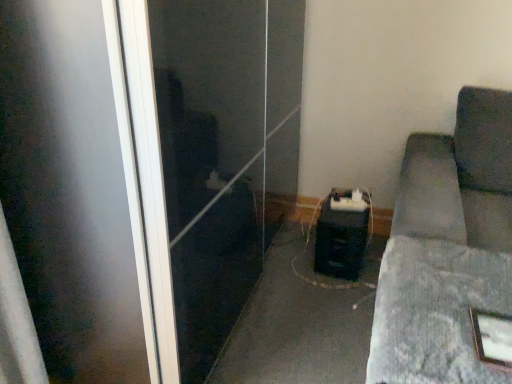
Find the location of a particular element. Image resolution: width=512 pixels, height=384 pixels. dark gray fabric couch at right is located at coordinates (447, 249).

The height and width of the screenshot is (384, 512). Find the location of `dark gray fabric couch at right`. dark gray fabric couch at right is located at coordinates (447, 249).

Is transparent glass screen door at center at the back of dark gray fabric couch at right?

No, dark gray fabric couch at right is not facing the opposite direction of transparent glass screen door at center.

Is dark gray fabric couch at right located outside transparent glass screen door at center?

Yes, dark gray fabric couch at right is not within transparent glass screen door at center.

Based on the photo, does dark gray fabric couch at right have a greater height compared to transparent glass screen door at center?

No.

Does dark gray fabric couch at right come behind transparent glass screen door at center?

No, dark gray fabric couch at right is in front of transparent glass screen door at center.

Consider the image. From a real-world perspective, is transparent glass screen door at center located higher than gray fabric couch at lower right, the 1th concrete positioned from the front?

Yes, from a real-world perspective, transparent glass screen door at center is on top of gray fabric couch at lower right, the 1th concrete positioned from the front.

Between transparent glass screen door at center and gray fabric couch at lower right, which is the second concrete from back to front, which one appears on the left side from the viewer's perspective?

From the viewer's perspective, transparent glass screen door at center appears more on the left side.

In the scene shown: From the image's perspective, which one is positioned higher, transparent glass screen door at center or gray fabric couch at lower right, which is the second concrete from back to front?

transparent glass screen door at center.

Image resolution: width=512 pixels, height=384 pixels. I want to click on furniture on the right of the black plastic speaker at center, the 2th concrete viewed from the front, so click(x=447, y=249).

Does point (284, 278) appear closer or farther from the camera than point (383, 295)?

Clearly, point (284, 278) is more distant from the camera than point (383, 295).

Is the depth of black plastic speaker at center, the 2th concrete viewed from the front, greater than that of dark gray fabric couch at right?

Yes, it is behind dark gray fabric couch at right.

From a real-world perspective, is black plastic speaker at center, the 2th concrete viewed from the front, physically located above or below dark gray fabric couch at right?

From a real-world perspective, black plastic speaker at center, the 2th concrete viewed from the front, is physically below dark gray fabric couch at right.

Does gray fabric couch at lower right, the 1th concrete positioned from the front, turn towards wooden picture frame at lower right?

Yes, gray fabric couch at lower right, the 1th concrete positioned from the front, is turned towards wooden picture frame at lower right.

Does point (507, 275) come closer to viewer compared to point (511, 336)?

No, (507, 275) is further to viewer.

From a real-world perspective, does gray fabric couch at lower right, the 1th concrete positioned from the front, sit lower than wooden picture frame at lower right?

Yes, from a real-world perspective, gray fabric couch at lower right, the 1th concrete positioned from the front, is below wooden picture frame at lower right.

From the picture: Is gray fabric couch at lower right, which is the second concrete from back to front, not near wooden picture frame at lower right?

No, gray fabric couch at lower right, which is the second concrete from back to front, is not far from wooden picture frame at lower right.

In the image, there is a transparent glass screen door at center. Identify the location of picture frame below it (from the image's perspective). The image size is (512, 384). (492, 337).

Is point (500, 348) farther from camera compared to point (149, 274)?

That is False.

In the image, is wooden picture frame at lower right on the left side or the right side of transparent glass screen door at center?

In the image, wooden picture frame at lower right appears on the right side of transparent glass screen door at center.

Who is more distant, wooden picture frame at lower right or transparent glass screen door at center?

wooden picture frame at lower right is further from the camera.

Is gray fabric couch at lower right, the 1th concrete positioned from the front, wider than transparent glass screen door at center?

In fact, gray fabric couch at lower right, the 1th concrete positioned from the front, might be narrower than transparent glass screen door at center.

Is gray fabric couch at lower right, which is the second concrete from back to front, aimed at transparent glass screen door at center?

No, gray fabric couch at lower right, which is the second concrete from back to front, is not oriented towards transparent glass screen door at center.

Does gray fabric couch at lower right, the 1th concrete positioned from the front, appear on the right side of transparent glass screen door at center?

Yes, gray fabric couch at lower right, the 1th concrete positioned from the front, is to the right of transparent glass screen door at center.

In the scene shown: Is the depth of gray fabric couch at lower right, the 1th concrete positioned from the front, greater than that of transparent glass screen door at center?

No, the depth of gray fabric couch at lower right, the 1th concrete positioned from the front, is less than that of transparent glass screen door at center.

Would you say dark gray fabric couch at right is outside black plastic speaker at center, the 2th concrete viewed from the front?

Yes, dark gray fabric couch at right is outside of black plastic speaker at center, the 2th concrete viewed from the front.

Is point (385, 319) in front of point (265, 282)?

Yes.

From a real-world perspective, between dark gray fabric couch at right and black plastic speaker at center, the 2th concrete viewed from the front, who is vertically higher?

dark gray fabric couch at right, from a real-world perspective.

Does dark gray fabric couch at right have a larger size compared to black plastic speaker at center, the 1th concrete from the back?

Correct, dark gray fabric couch at right is larger in size than black plastic speaker at center, the 1th concrete from the back.

Find the location of `screen door above the dark gray fabric couch at right (from the image's perspective)`. screen door above the dark gray fabric couch at right (from the image's perspective) is located at coordinates (208, 158).

Identify the location of the 1st concrete positioned below the transparent glass screen door at center (from a real-world perspective). (435, 312).

When comparing their distances from gray fabric couch at lower right, which is the second concrete from back to front, does wooden picture frame at lower right or dark gray fabric couch at right seem further?

wooden picture frame at lower right is positioned further to the anchor gray fabric couch at lower right, which is the second concrete from back to front.

From the image, which object appears to be nearer to transparent glass screen door at center, gray fabric couch at lower right, which is the second concrete from back to front, or dark gray fabric couch at right?

gray fabric couch at lower right, which is the second concrete from back to front, lies closer to transparent glass screen door at center than the other object.

Looking at the image, which one is located further to wooden picture frame at lower right, black plastic speaker at center, the 2th concrete viewed from the front, or dark gray fabric couch at right?

black plastic speaker at center, the 2th concrete viewed from the front, is positioned further to the anchor wooden picture frame at lower right.

Considering their positions, is dark gray fabric couch at right positioned closer to gray fabric couch at lower right, the 1th concrete positioned from the front, than wooden picture frame at lower right?

Based on the image, dark gray fabric couch at right appears to be nearer to gray fabric couch at lower right, the 1th concrete positioned from the front.

Considering their positions, is gray fabric couch at lower right, which is the second concrete from back to front, positioned closer to dark gray fabric couch at right than wooden picture frame at lower right?

gray fabric couch at lower right, which is the second concrete from back to front.

Based on their spatial positions, is wooden picture frame at lower right or black plastic speaker at center, the 2th concrete viewed from the front, further from gray fabric couch at lower right, which is the second concrete from back to front?

black plastic speaker at center, the 2th concrete viewed from the front.

Based on their spatial positions, is dark gray fabric couch at right or gray fabric couch at lower right, which is the second concrete from back to front, closer to transparent glass screen door at center?

gray fabric couch at lower right, which is the second concrete from back to front, is positioned closer to the anchor transparent glass screen door at center.

Considering their positions, is black plastic speaker at center, the 2th concrete viewed from the front, positioned further to transparent glass screen door at center than dark gray fabric couch at right?

dark gray fabric couch at right is positioned further to the anchor transparent glass screen door at center.

Find the location of a particular element. This screenshot has height=384, width=512. picture frame between transparent glass screen door at center and dark gray fabric couch at right from left to right is located at coordinates (492, 337).

What are the coordinates of `picture frame positioned between dark gray fabric couch at right and black plastic speaker at center, the 1th concrete from the back, from near to far` in the screenshot? It's located at (492, 337).

You are a GUI agent. You are given a task and a screenshot of the screen. Output one action in this format:
    pyautogui.click(x=<x>, y=<y>)
    Task: Click on the concrete positioned between dark gray fabric couch at right and wooden picture frame at lower right from near to far
    This screenshot has width=512, height=384.
    Given the screenshot: What is the action you would take?
    coord(435,312)

Where is `concrete between transparent glass screen door at center and gray fabric couch at lower right, the 1th concrete positioned from the front, from left to right`? This screenshot has height=384, width=512. concrete between transparent glass screen door at center and gray fabric couch at lower right, the 1th concrete positioned from the front, from left to right is located at coordinates (297, 324).